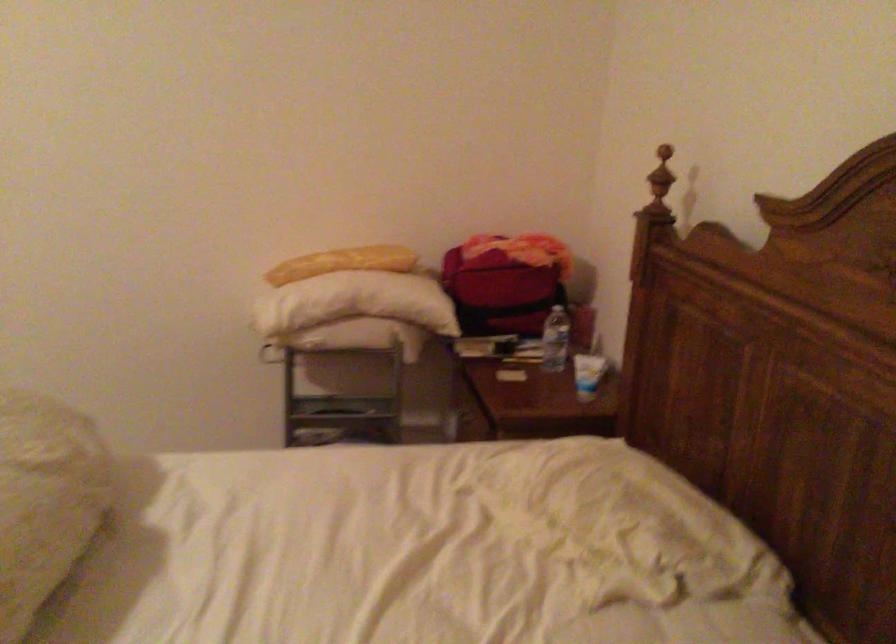
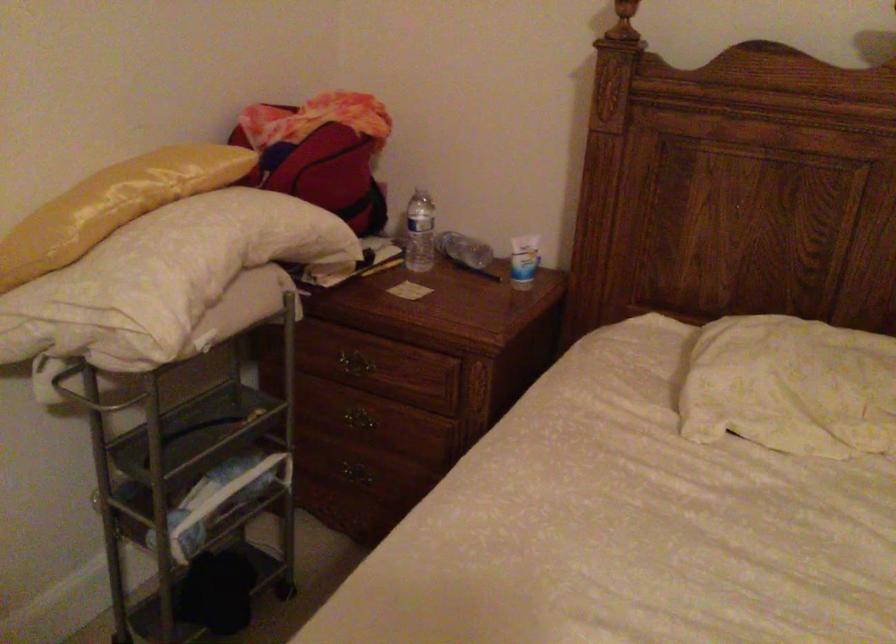
Question: I am providing you with two images of the same scene from different viewpoints. After the viewpoint changes to image2, which objects are now occluded?

Choices:
 (A) metal cart handle
 (B) plastic water bottle
 (C) white lotion tube
 (D) none of these

Answer: (D)